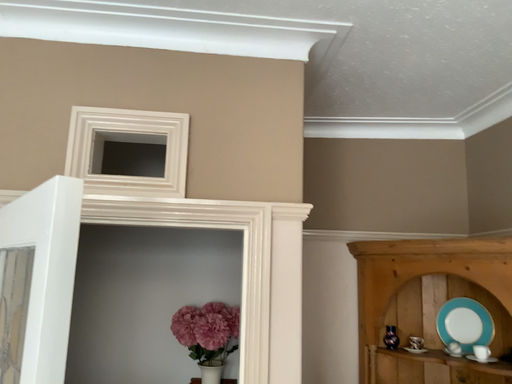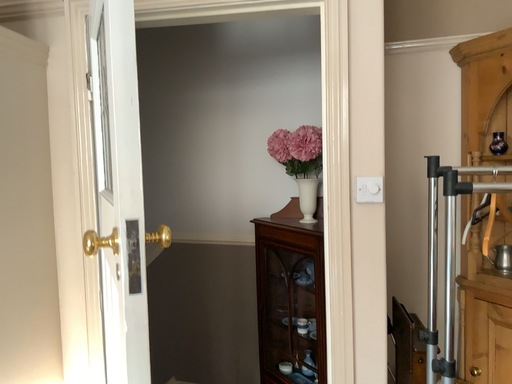
Question: How did the camera likely rotate when shooting the video?

Choices:
 (A) rotated downward
 (B) rotated upward

Answer: (A)